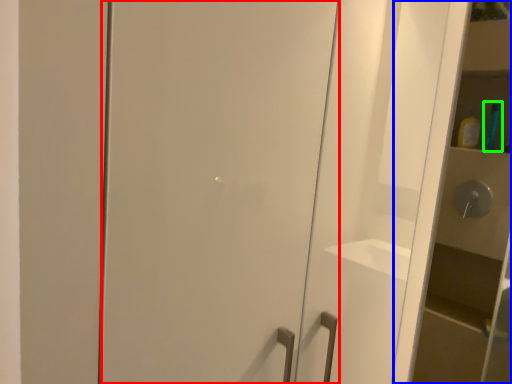
Question: Estimate the real-world distances between objects in this image. Which object is closer to door (highlighted by a red box), cabinetry (highlighted by a blue box) or toiletry (highlighted by a green box)?

Choices:
 (A) cabinetry
 (B) toiletry

Answer: (A)